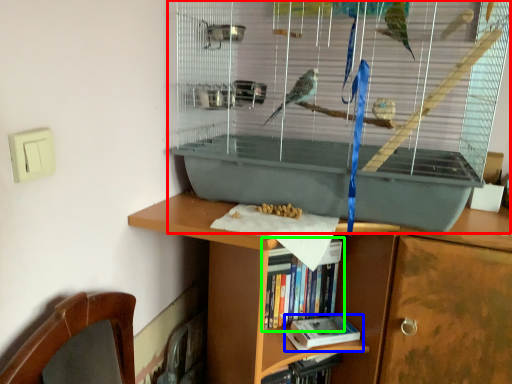
Question: Estimate the real-world distances between objects in this image. Which object is farther from bird cage (highlighted by a red box), book (highlighted by a blue box) or book (highlighted by a green box)?

Choices:
 (A) book
 (B) book

Answer: (A)